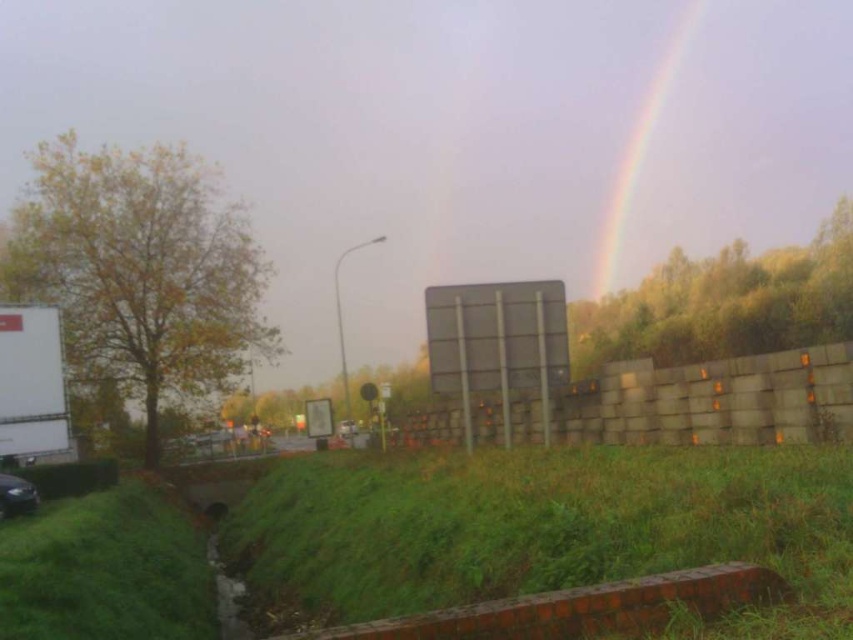
Between green grass at lower center and rainbow at upper right, which one has less height?

With less height is green grass at lower center.

Is green grass at lower center smaller than rainbow at upper right?

Yes.

Describe the element at coordinates (541, 529) in the screenshot. This screenshot has width=853, height=640. I see `green grass at lower center` at that location.

Where is `green grass at lower center`? The width and height of the screenshot is (853, 640). green grass at lower center is located at coordinates point(541,529).

How distant is white matte trailer truck at left from rainbow at upper right?

226.93 feet

Is point (27, 420) behind point (651, 132)?

No, (27, 420) is closer to viewer.

The height and width of the screenshot is (640, 853). What do you see at coordinates (32, 381) in the screenshot?
I see `white matte trailer truck at left` at bounding box center [32, 381].

Where is `white matte trailer truck at left`? Image resolution: width=853 pixels, height=640 pixels. white matte trailer truck at left is located at coordinates click(x=32, y=381).

Between point (131, 612) and point (618, 243), which one is positioned behind?

The point (618, 243) is more distant.

Can you confirm if green grass at lower left is bigger than rainbow at upper right?

No, green grass at lower left is not bigger than rainbow at upper right.

Is point (143, 586) less distant than point (663, 58)?

That is True.

Find the location of a particular element. This screenshot has width=853, height=640. green grass at lower left is located at coordinates (105, 570).